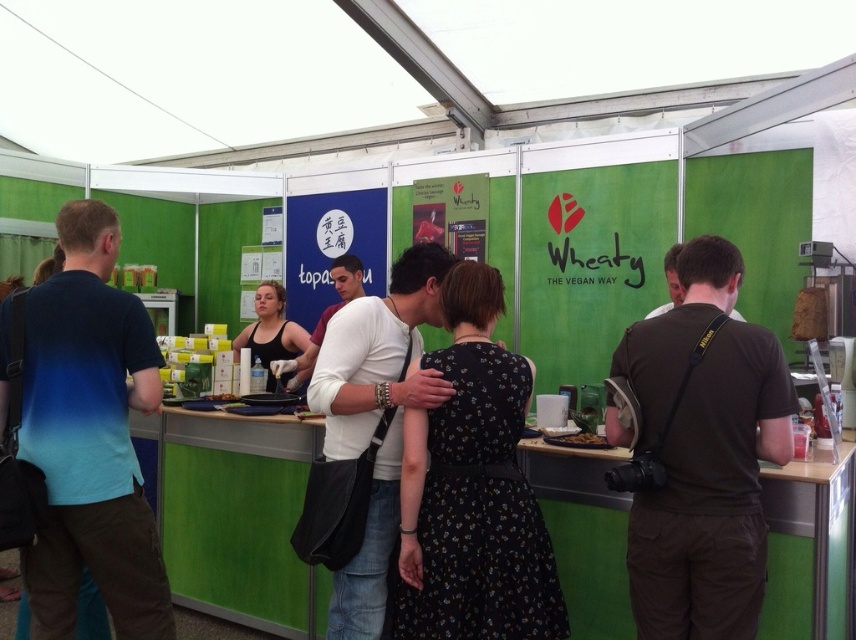
Question: Which of the following is the closest to the observer?

Choices:
 (A) black fabric tank top at center
 (B) white matte shirt at center
 (C) blue gradient t-shirt at left
 (D) black floral dress at center

Answer: (D)

Question: Which of these objects is positioned farthest from the black fabric tank top at center?

Choices:
 (A) white matte shirt at center
 (B) blue gradient t-shirt at left

Answer: (B)

Question: Is floral dress at center thinner than white matte shirt at center?

Choices:
 (A) no
 (B) yes

Answer: (B)

Question: Can you confirm if blue gradient t-shirt at left is positioned to the left of floral dress at center?

Choices:
 (A) yes
 (B) no

Answer: (A)

Question: Is black fabric tank top at center smaller than brown crumbly at center?

Choices:
 (A) yes
 (B) no

Answer: (B)

Question: Among these objects, which one is nearest to the camera?

Choices:
 (A) white matte shirt at center
 (B) blue gradient t-shirt at left

Answer: (B)